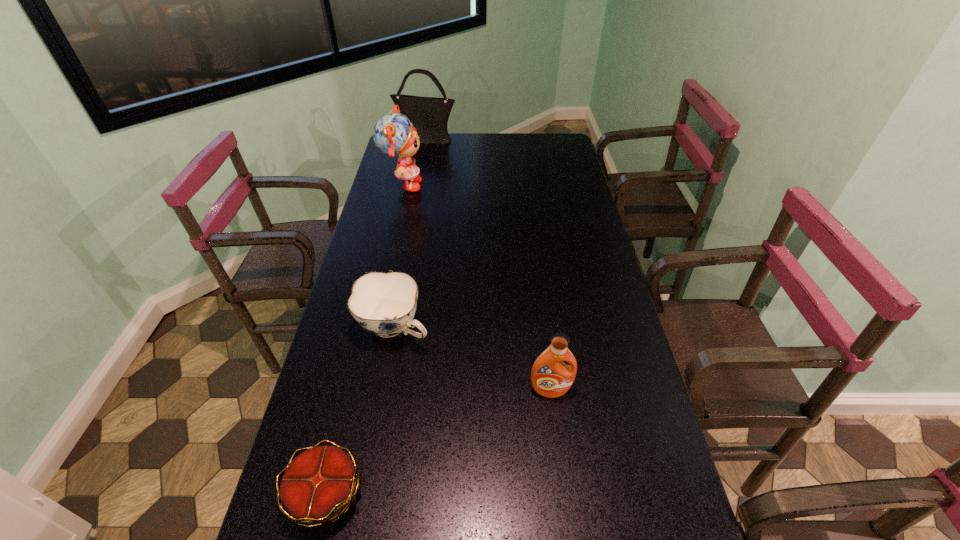
Find the location of a particular element. object that is the second closest to the third nearest object is located at coordinates (318, 487).

You are a GUI agent. You are given a task and a screenshot of the screen. Output one action in this format:
    pyautogui.click(x=<x>, y=<y>)
    Task: Click on the object that is the closest to the nearest object
    
    Given the screenshot: What is the action you would take?
    pyautogui.click(x=384, y=304)

At what (x,y) coordinates should I click in order to perform the action: click on vacant space that satisfies the following two spatial constraints: 1. on the face of the doll; 2. on the right side of the chinaware. Please return your answer as a coordinate pair (x, y). Looking at the image, I should click on (371, 327).

Where is `free spot that satisfies the following two spatial constraints: 1. on the face of the doll; 2. on the front side of the crown`? This screenshot has height=540, width=960. free spot that satisfies the following two spatial constraints: 1. on the face of the doll; 2. on the front side of the crown is located at coordinates (332, 494).